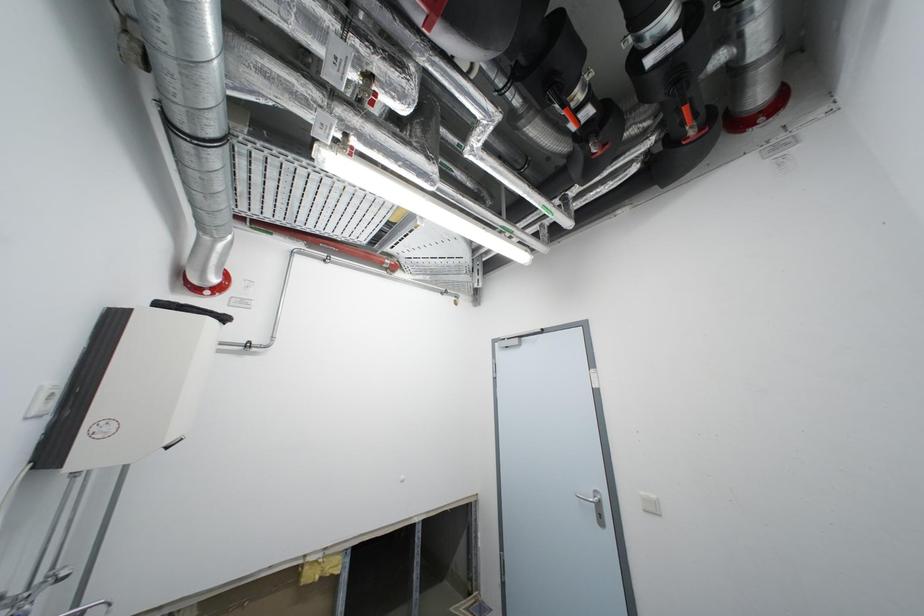
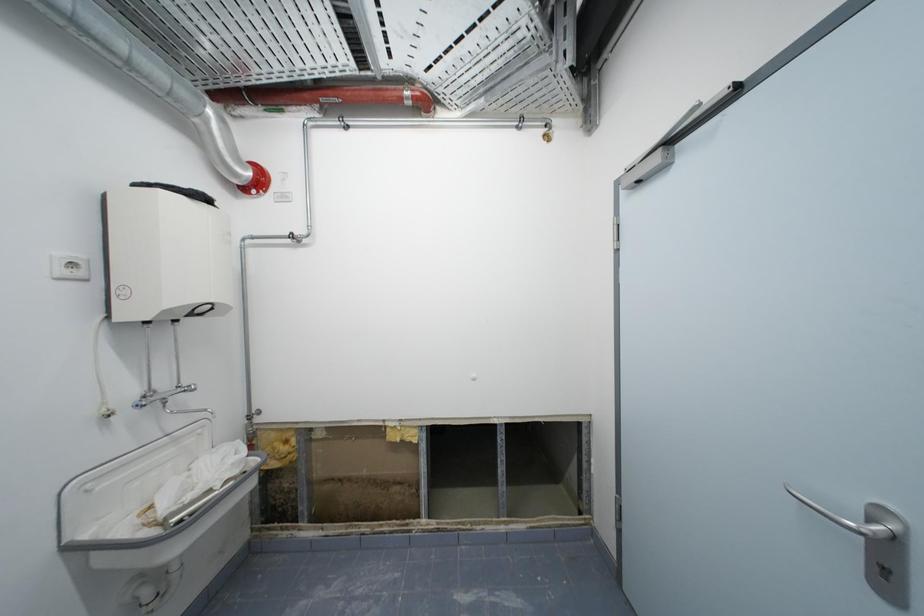
The first image is from the beginning of the video and the second image is from the end. How did the camera likely rotate when shooting the video?

The camera rotated toward left-down.